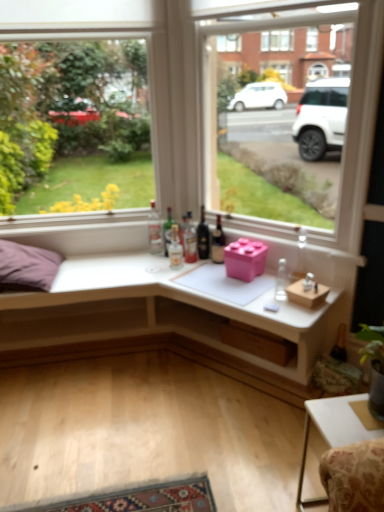
The image size is (384, 512). I want to click on unoccupied space behind clear glass bottle at center, the first bottle positioned from the right, so click(264, 285).